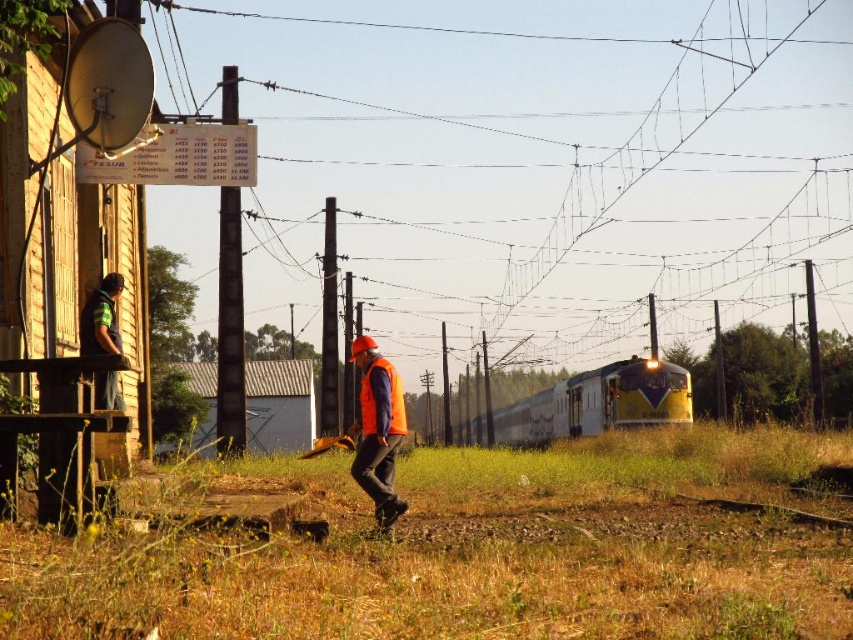
From the picture: You are standing at the railway station and want to take a photo of both point (503, 433) and point (383, 522) in the image. Which point should you move towards to ensure both are in frame?

You should move towards point (383, 522) because point (503, 433) is further away from the camera than point (383, 522). By moving towards the closer point, you can better frame both points within the camera view.

You are a maintenance worker at the station and need to locate your safety gear. You remember placing an orange reflective vest at center and an orange matte safety vest at center somewhere near the wooden structure. Based on the image, which vest is positioned lower?

The orange reflective vest at center is below the orange matte safety vest at center, so the orange reflective vest at center is positioned lower.